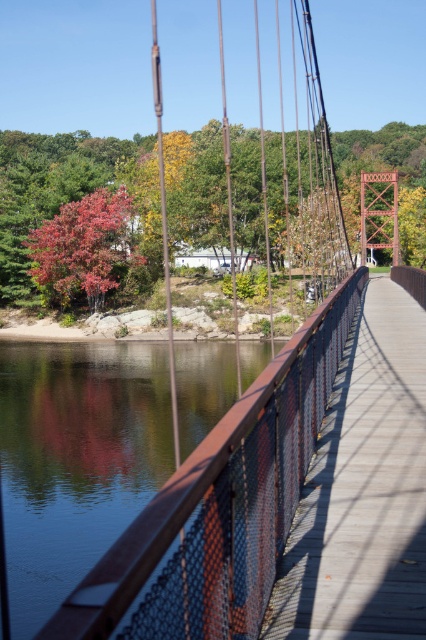
Question: Which point is closer to the camera?

Choices:
 (A) (367, 410)
 (B) (37, 266)

Answer: (A)

Question: Is wooden bridge at center further to the viewer compared to vivid red leaves at left?

Choices:
 (A) no
 (B) yes

Answer: (A)

Question: Can you confirm if wooden bridge at center is wider than reddish-brown bark tree at left?

Choices:
 (A) yes
 (B) no

Answer: (B)

Question: In this image, where is wooden bridge at center located relative to vivid red leaves at left?

Choices:
 (A) above
 (B) below

Answer: (B)

Question: Among these objects, which one is farthest from the camera?

Choices:
 (A) glossy water at center
 (B) wooden bridge at center

Answer: (A)

Question: Among these objects, which one is farthest from the camera?

Choices:
 (A) reddish-brown bark tree at left
 (B) vivid red leaves at left
 (C) glossy water at center
 (D) wooden bridge at center

Answer: (B)